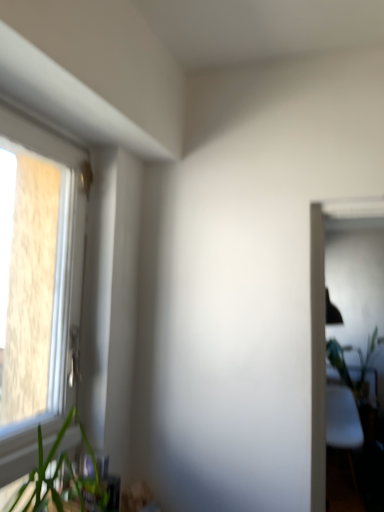
Question: Should I look upward or downward to see green leafy plant at lower left?

Choices:
 (A) down
 (B) up

Answer: (A)

Question: Is green leafy plant at lower left located within white plastic window at left?

Choices:
 (A) yes
 (B) no

Answer: (B)

Question: Is white plastic window at left positioned with its back to green leafy plant at lower left?

Choices:
 (A) no
 (B) yes

Answer: (A)

Question: Is white plastic window at left shorter than green leafy plant at lower left?

Choices:
 (A) no
 (B) yes

Answer: (A)

Question: Does white plastic window at left come in front of green leafy plant at lower left?

Choices:
 (A) no
 (B) yes

Answer: (A)

Question: Can you confirm if white plastic window at left is bigger than green leafy plant at lower left?

Choices:
 (A) no
 (B) yes

Answer: (B)

Question: From a real-world perspective, is white plastic window at left on green leafy plant at lower left?

Choices:
 (A) yes
 (B) no

Answer: (A)

Question: Is green leafy plant at right wider than white plastic window at left?

Choices:
 (A) no
 (B) yes

Answer: (B)

Question: Would you say green leafy plant at right contains white plastic window at left?

Choices:
 (A) no
 (B) yes

Answer: (A)

Question: Can you confirm if green leafy plant at right is positioned to the right of white plastic window at left?

Choices:
 (A) yes
 (B) no

Answer: (A)

Question: Is green leafy plant at right smaller than white plastic window at left?

Choices:
 (A) no
 (B) yes

Answer: (A)

Question: From a real-world perspective, is green leafy plant at right below white plastic window at left?

Choices:
 (A) yes
 (B) no

Answer: (A)

Question: Is green leafy plant at right shorter than white plastic window at left?

Choices:
 (A) yes
 (B) no

Answer: (A)

Question: Considering the relative sizes of green leafy plant at lower left and green leafy plant at right in the image provided, is green leafy plant at lower left thinner than green leafy plant at right?

Choices:
 (A) yes
 (B) no

Answer: (A)